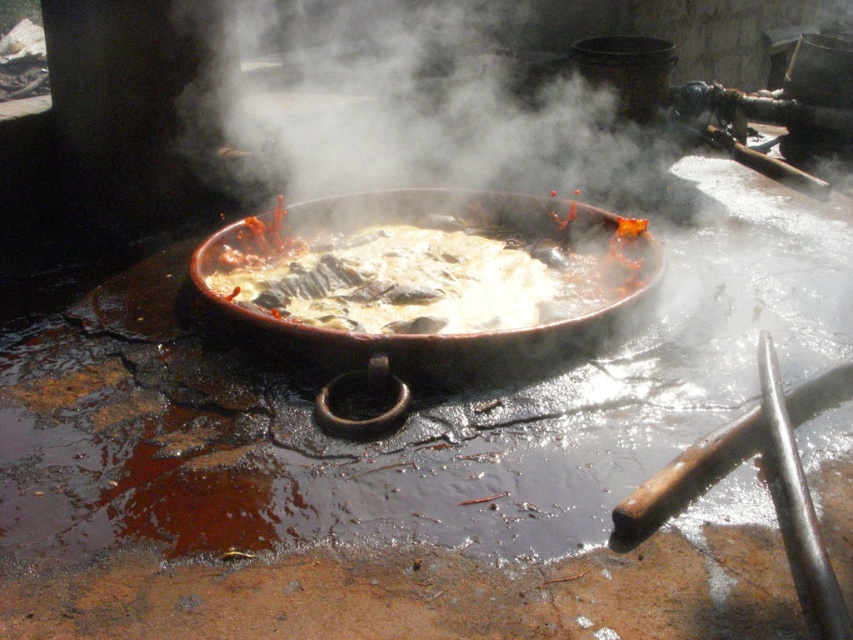
You are a chef preparing a dish and need to know which object is taller between the shiny black wok at center and the white vapor at center. Based on the scene described, which one is taller?

The white vapor at center is taller than the shiny black wok at center according to the description.

You are a chef preparing a dish and need to know if the shiny black wok at center can fit into a storage cabinet that is 50 cm wide. The white vapor at center is obstructing your view. Can you determine if the wok will fit based on the visible information?

The shiny black wok at center has a width less than the white vapor at center. Since the vapor is obstructing the view, it is unclear if the wok is narrower than 50 cm. Further measurement is needed to confirm if it fits the cabinet.

You are a chef standing near the shiny black wok at center and the white vapor at center. You need to grab a ladle from a shelf 6 feet away. Can you reach the shelf without moving closer?

The shiny black wok at center is 5.73 feet away from white vapor at center. Since the shelf is 6 feet away, the chef can reach the shelf without moving closer because the distance is slightly more than the 5.73 feet between the objects.